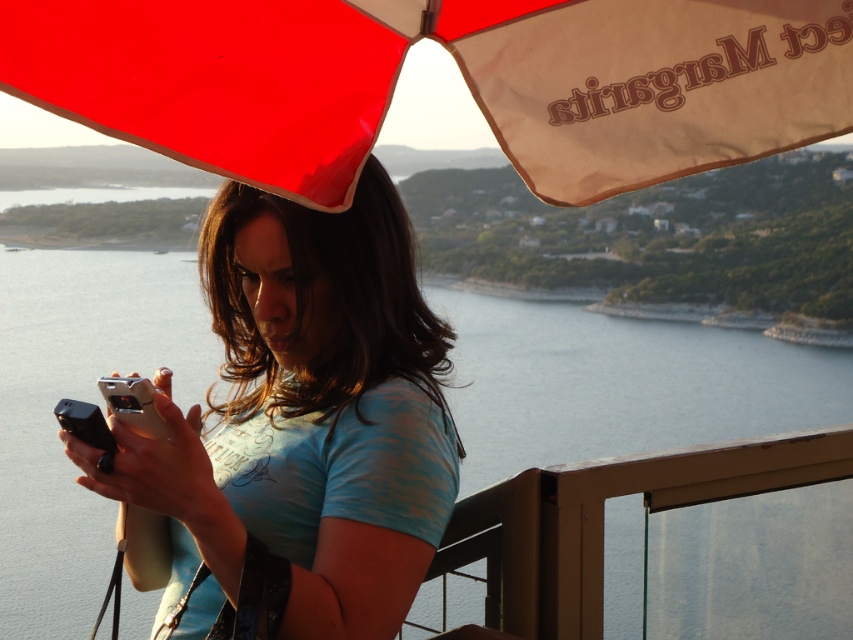
You are standing at the point with coordinates [461,72] in the image. What object are you standing on?

You are standing on the red fabric umbrella at upper center.

You are a photographer trying to capture the scenic view of the clear water at center while ensuring the matte blue shirt at center is also visible in the frame. Based on their sizes, which object should you focus on first to ensure both are in the shot?

The clear water at center is larger in size than the matte blue shirt at center, so you should focus on the clear water at center first to ensure both are in the shot since it takes up more space and can be framed appropriately before adjusting for the smaller matte blue shirt at center.